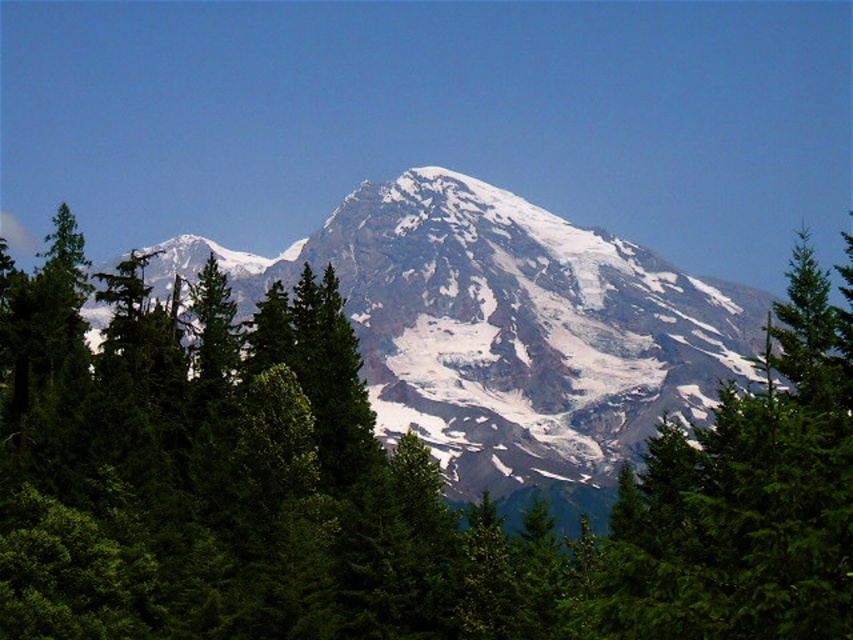
Question: Is white snow-covered mountain at center above green evergreen tree at center?

Choices:
 (A) no
 (B) yes

Answer: (B)

Question: Does white snow-covered mountain at center have a greater width compared to green evergreen tree at center?

Choices:
 (A) no
 (B) yes

Answer: (B)

Question: Which object appears farthest from the camera in this image?

Choices:
 (A) white snow-covered mountain at center
 (B) green evergreen tree at center

Answer: (A)

Question: Observing the image, what is the correct spatial positioning of white snow-covered mountain at center in reference to green evergreen tree at center?

Choices:
 (A) right
 (B) left

Answer: (B)

Question: Which point is farther from the camera taking this photo?

Choices:
 (A) (431, 419)
 (B) (653, 632)

Answer: (A)